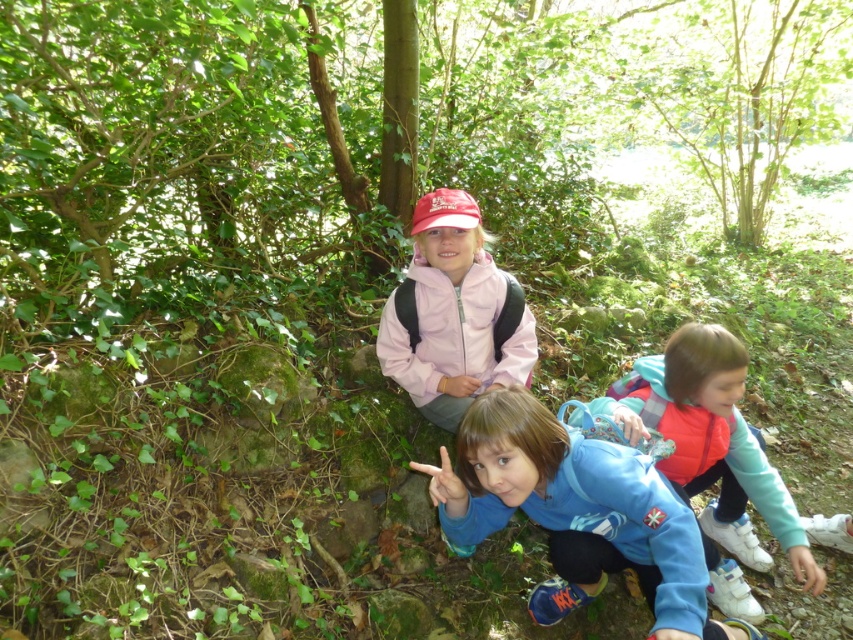
Is point (614, 570) closer to camera compared to point (416, 250)?

That is True.

Is point (672, 556) positioned in front of point (405, 276)?

Yes, it is.

Where is `blue fleece jacket at center`? This screenshot has width=853, height=640. blue fleece jacket at center is located at coordinates pos(576,513).

Between blue fleece jacket at lower right and pink matte jacket at center, which one is positioned higher?

pink matte jacket at center is above.

This screenshot has height=640, width=853. What do you see at coordinates (712, 458) in the screenshot?
I see `blue fleece jacket at lower right` at bounding box center [712, 458].

At what (x,y) coordinates should I click in order to perform the action: click on blue fleece jacket at lower right. Please return your answer as a coordinate pair (x, y). This screenshot has height=640, width=853. Looking at the image, I should click on tap(712, 458).

Between point (766, 124) and point (381, 364), which one is positioned behind?

The point (766, 124) is more distant.

Which of these two, green leafy tree at upper center or pink matte jacket at center, stands shorter?

pink matte jacket at center is shorter.

Is point (656, 100) farther from viewer compared to point (498, 272)?

That is True.

Where is `green leafy tree at upper center`? green leafy tree at upper center is located at coordinates (747, 93).